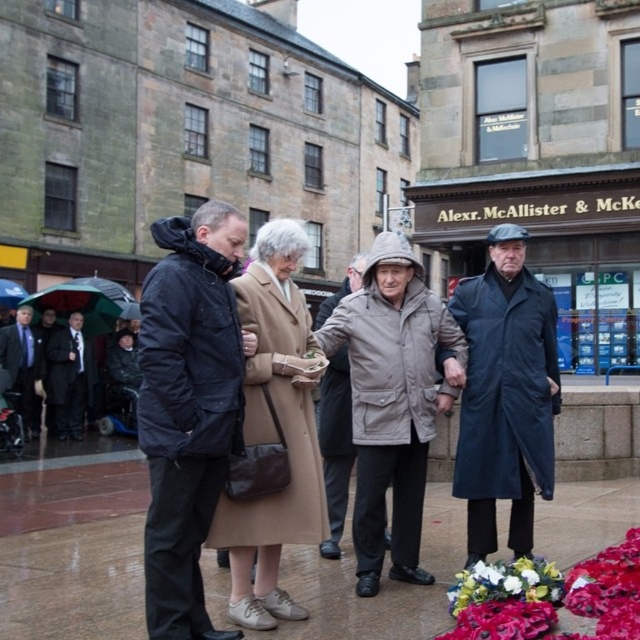
Is point (486, 636) farther from viewer compared to point (22, 298)?

No, (486, 636) is in front of (22, 298).

Between fluffy fabric bouquet at lower right and transparent plastic umbrella at upper left, which one has more height?

transparent plastic umbrella at upper left

Describe the element at coordinates (552, 596) in the screenshot. I see `fluffy fabric bouquet at lower right` at that location.

Find the location of a particular element. The image size is (640, 640). fluffy fabric bouquet at lower right is located at coordinates (552, 596).

Can you confirm if dark blue jacket at center is wider than transparent plastic umbrella at upper left?

Yes.

Between dark blue jacket at center and transparent plastic umbrella at upper left, which one is positioned higher?

transparent plastic umbrella at upper left

Where is `dark blue jacket at center`? Image resolution: width=640 pixels, height=640 pixels. dark blue jacket at center is located at coordinates (188, 406).

Consider the image. Which of these two, dark blue suit at left or transparent plastic umbrella at upper left, stands shorter?

dark blue suit at left

This screenshot has width=640, height=640. Identify the location of dark blue suit at left. (22, 365).